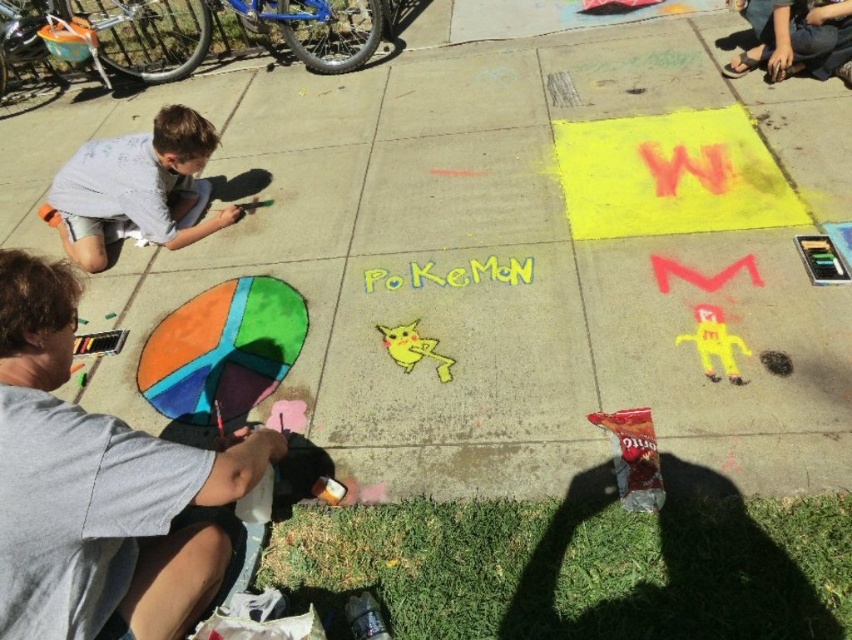
Who is more distant from viewer, (183,624) or (194,134)?

The point (194,134) is behind.

Who is higher up, smooth gray shirt at lower left or light gray shirt at upper left?

light gray shirt at upper left is higher up.

Is point (119, 568) positioned in front of point (73, 156)?

That is True.

You are a GUI agent. You are given a task and a screenshot of the screen. Output one action in this format:
    pyautogui.click(x=<x>, y=<y>)
    Task: Click on the smooth gray shirt at lower left
    The width and height of the screenshot is (852, 640).
    Given the screenshot: What is the action you would take?
    pyautogui.click(x=98, y=488)